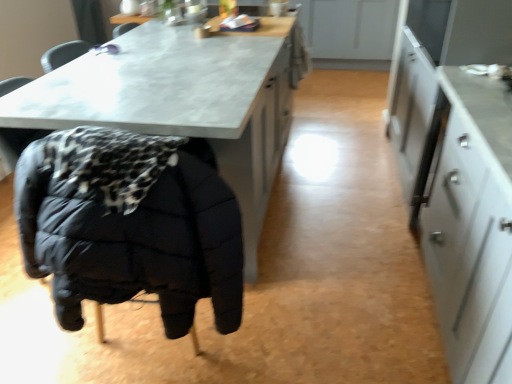
Question: Considering the positions of point (509, 266) and point (252, 36), is point (509, 266) closer or farther from the camera than point (252, 36)?

Choices:
 (A) farther
 (B) closer

Answer: (B)

Question: Considering the positions of white glossy cabinet at right and matte gray table at center in the image, is white glossy cabinet at right bigger or smaller than matte gray table at center?

Choices:
 (A) small
 (B) big

Answer: (A)

Question: Which is nearer to the matte gray table at center?

Choices:
 (A) black quilted jacket at lower left
 (B) white glossy cabinet at right

Answer: (A)

Question: Which of these objects is positioned farthest from the black quilted jacket at lower left?

Choices:
 (A) white glossy cabinet at right
 (B) matte gray table at center

Answer: (A)